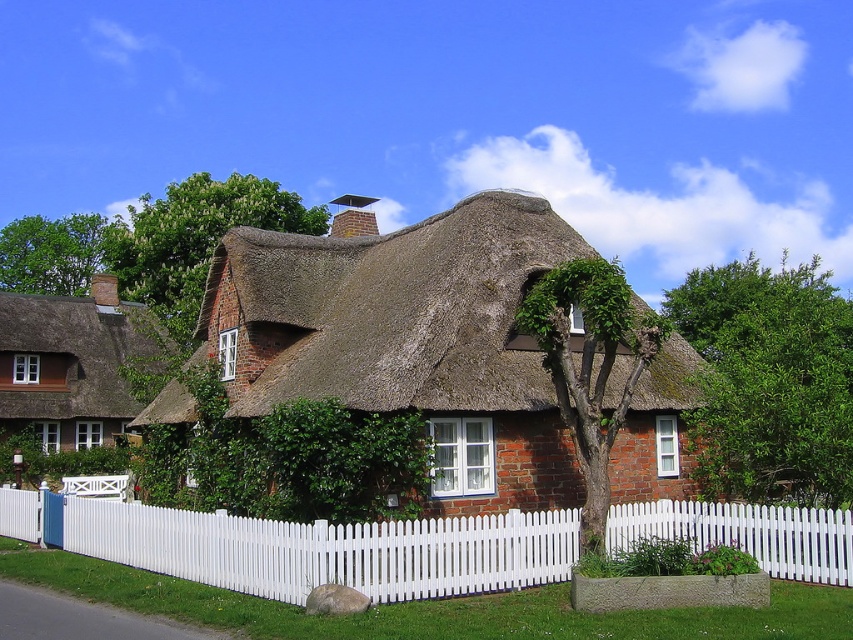
Is point (780, 484) more distant than point (38, 314)?

No, (780, 484) is in front of (38, 314).

Does green leafy ivy at right appear on the left side of matte brown thatched roof at left?

No, green leafy ivy at right is not to the left of matte brown thatched roof at left.

Is point (795, 481) closer to camera compared to point (67, 410)?

That is True.

At what (x,y) coordinates should I click in order to perform the action: click on green leafy ivy at right. Please return your answer as a coordinate pair (x, y). This screenshot has height=640, width=853. Looking at the image, I should click on (769, 380).

Between brown thatch roof at center and matte brown thatched roof at left, which one has less height?

brown thatch roof at center is shorter.

Is brown thatch roof at center taller than matte brown thatched roof at left?

No, brown thatch roof at center is not taller than matte brown thatched roof at left.

Find the location of a particular element. The height and width of the screenshot is (640, 853). brown thatch roof at center is located at coordinates (387, 310).

Is brown thatch roof at center above white picket fence at center?

Indeed, brown thatch roof at center is positioned over white picket fence at center.

Can you confirm if brown thatch roof at center is positioned to the right of white picket fence at center?

Indeed, brown thatch roof at center is positioned on the right side of white picket fence at center.

This screenshot has height=640, width=853. What do you see at coordinates (387, 310) in the screenshot?
I see `brown thatch roof at center` at bounding box center [387, 310].

Find the location of `brown thatch roof at center`. brown thatch roof at center is located at coordinates pyautogui.click(x=387, y=310).